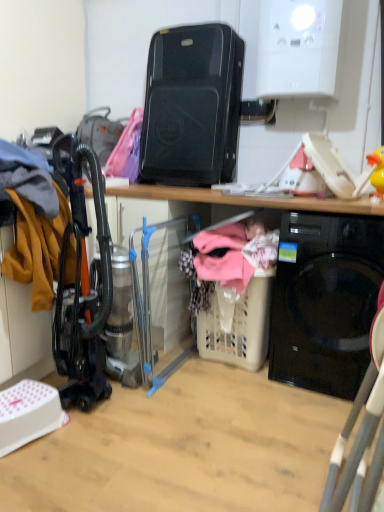
This screenshot has width=384, height=512. In order to click on vacant space in front of beige plastic laundry basket at lower center in this screenshot , I will do `click(248, 396)`.